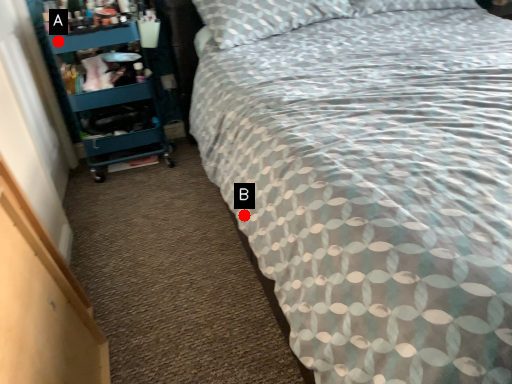
Question: Two points are circled on the image, labeled by A and B beside each circle. Which point is farther to the camera?

Choices:
 (A) A is further
 (B) B is further

Answer: (A)